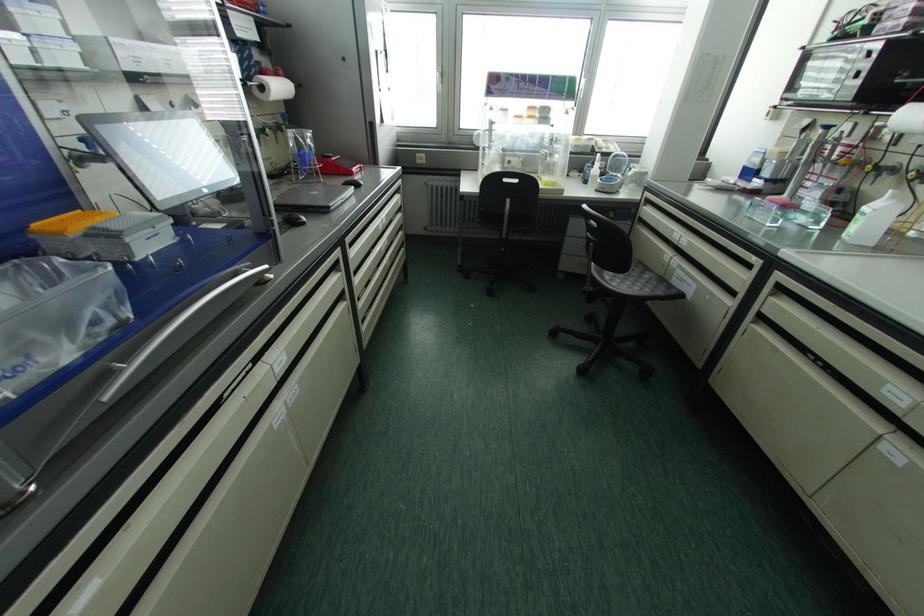
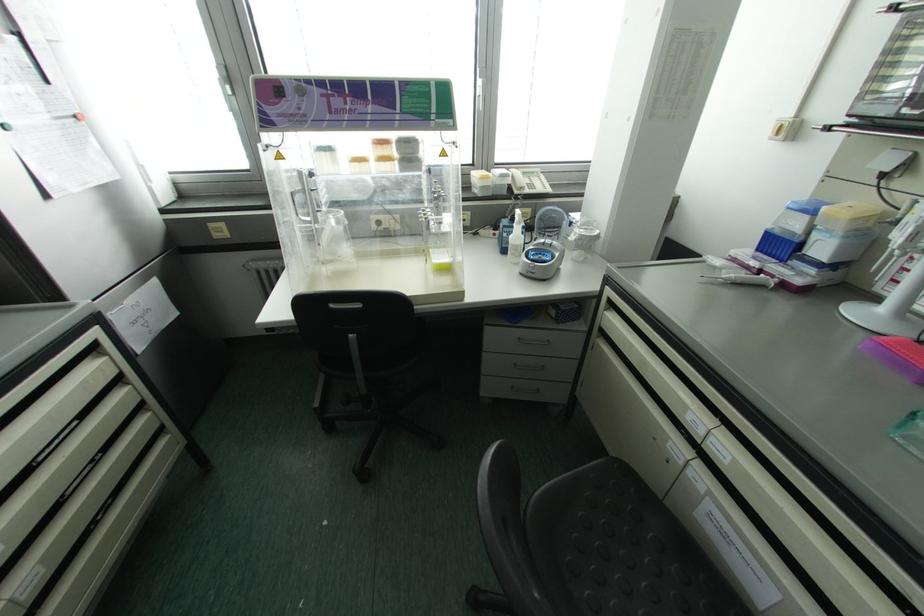
Locate, in the second image, the point that corresponds to the point at 594,169 in the first image.

(516, 235)